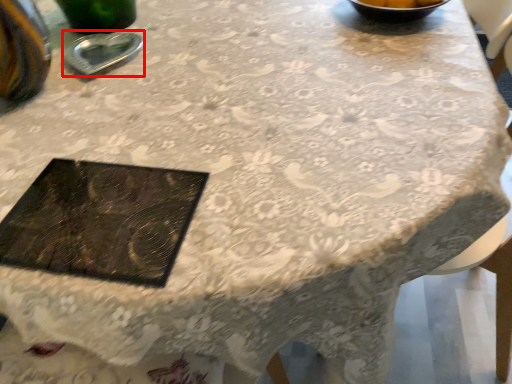
Question: From the image, what is the correct spatial relationship of tableware (annotated by the red box) in relation to tray?

Choices:
 (A) left
 (B) right

Answer: (A)